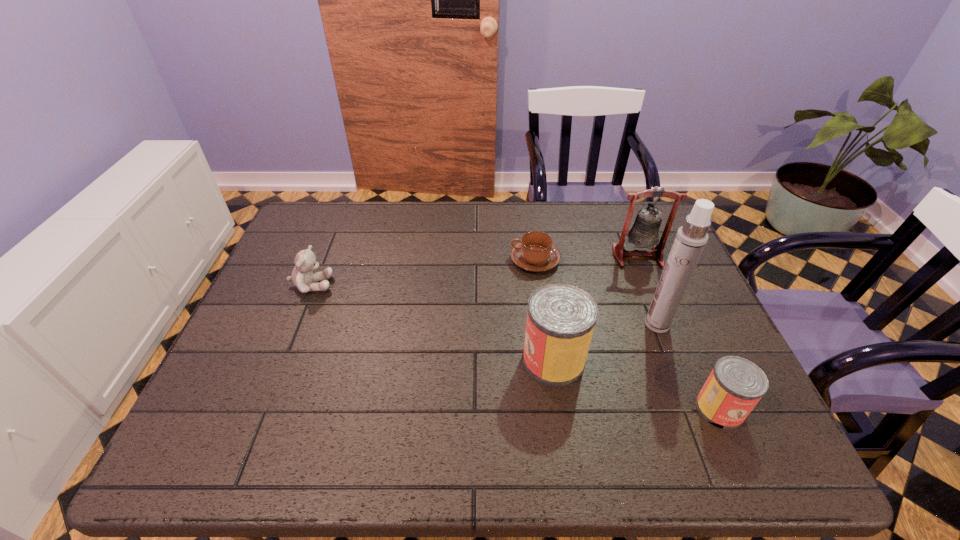
Observe the arrangement of all cans in the image. To keep them evenly spaced, where would you place another can on the left? Please locate a free space. Please provide its 2D coordinates. Your answer should be formatted as a tuple, i.e. [(x, y)], where the tuple contains the x and y coordinates of a point satisfying the conditions above.

[(415, 319)]